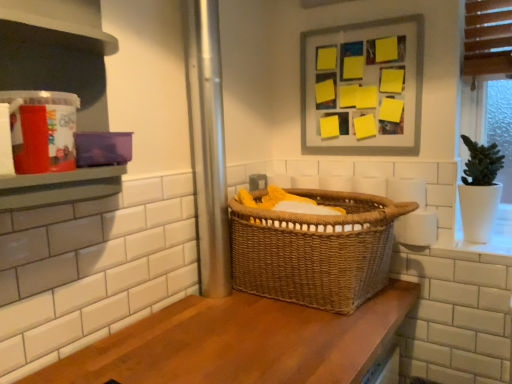
Question: Does matte plastic container at left have a lesser height compared to yellow paper at upper center?

Choices:
 (A) yes
 (B) no

Answer: (B)

Question: Are matte plastic container at left and yellow paper at upper center making contact?

Choices:
 (A) no
 (B) yes

Answer: (A)

Question: From a real-world perspective, does matte plastic container at left sit lower than yellow paper at upper center?

Choices:
 (A) no
 (B) yes

Answer: (B)

Question: Is there a large distance between matte plastic container at left and yellow paper at upper center?

Choices:
 (A) no
 (B) yes

Answer: (A)

Question: Does matte plastic container at left have a smaller size compared to yellow paper at upper center?

Choices:
 (A) no
 (B) yes

Answer: (A)

Question: From a real-world perspective, is white matte toilet paper at right, positioned as the 2th toilet paper in top-to-bottom order, above or below white matte toilet paper at right, which is the first toilet paper in top-to-bottom order?

Choices:
 (A) above
 (B) below

Answer: (B)

Question: Is white matte toilet paper at right, which appears as the 1th toilet paper when ordered from the bottom, wider or thinner than white matte toilet paper at right, positioned as the 2th toilet paper in bottom-to-top order?

Choices:
 (A) wide
 (B) thin

Answer: (A)

Question: Relative to white matte toilet paper at right, positioned as the 2th toilet paper in bottom-to-top order, is white matte toilet paper at right, which appears as the 1th toilet paper when ordered from the bottom, in front or behind?

Choices:
 (A) behind
 (B) front

Answer: (B)

Question: Is point (425, 241) positioned closer to the camera than point (414, 188)?

Choices:
 (A) farther
 (B) closer

Answer: (B)

Question: From the image's perspective, is white matte toilet paper at right, positioned as the 2th toilet paper in bottom-to-top order, located above or below woven brown basket at center?

Choices:
 (A) below
 (B) above

Answer: (B)

Question: Based on their sizes in the image, would you say white matte toilet paper at right, which is the first toilet paper in top-to-bottom order, is bigger or smaller than woven brown basket at center?

Choices:
 (A) small
 (B) big

Answer: (A)

Question: Would you say white matte toilet paper at right, which is the first toilet paper in top-to-bottom order, is inside or outside woven brown basket at center?

Choices:
 (A) outside
 (B) inside

Answer: (A)

Question: In terms of height, does white matte toilet paper at right, positioned as the 2th toilet paper in bottom-to-top order, look taller or shorter compared to woven brown basket at center?

Choices:
 (A) short
 (B) tall

Answer: (A)

Question: Considering the positions of white matte toilet paper at right, which appears as the 1th toilet paper when ordered from the bottom, and wooden counter at center in the image, is white matte toilet paper at right, which appears as the 1th toilet paper when ordered from the bottom, taller or shorter than wooden counter at center?

Choices:
 (A) tall
 (B) short

Answer: (A)

Question: In the image, is white matte toilet paper at right, which appears as the 1th toilet paper when ordered from the bottom, positioned in front of or behind wooden counter at center?

Choices:
 (A) behind
 (B) front

Answer: (A)